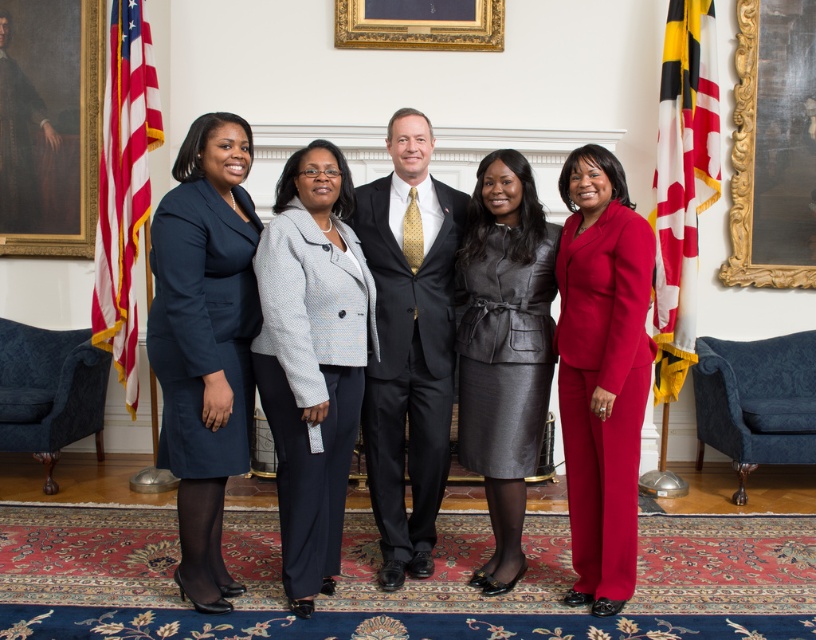
Can you confirm if matte navy coat at left is shorter than gold ornate picture frame at upper center?

Incorrect, matte navy coat at left's height does not fall short of gold ornate picture frame at upper center's.

Does point (169, 284) come farther from viewer compared to point (355, 19)?

No, (169, 284) is in front of (355, 19).

Does point (233, 282) come farther from viewer compared to point (486, 48)?

No, it is not.

Locate an element on the screen. This screenshot has width=816, height=640. matte navy coat at left is located at coordinates (205, 340).

Does matte black suit at center have a lesser height compared to gold ornate picture frame at upper center?

No, matte black suit at center is not shorter than gold ornate picture frame at upper center.

This screenshot has width=816, height=640. What do you see at coordinates (409, 333) in the screenshot? I see `matte black suit at center` at bounding box center [409, 333].

Find the location of a particular element. matte black suit at center is located at coordinates (409, 333).

Does matte black suit at center have a greater height compared to gold carved wood picture frame at upper right?

Correct, matte black suit at center is much taller as gold carved wood picture frame at upper right.

Does matte black suit at center appear on the left side of gold carved wood picture frame at upper right?

Indeed, matte black suit at center is positioned on the left side of gold carved wood picture frame at upper right.

Which is in front, point (375, 180) or point (757, 148)?

Point (375, 180) is in front.

Image resolution: width=816 pixels, height=640 pixels. I want to click on matte black suit at center, so click(409, 333).